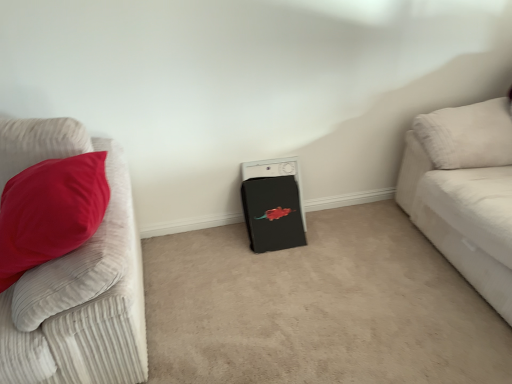
Question: Is velvet red pillow at left, placed as the 2th studio couch when sorted from right to left, inside or outside of black matte washing machine at center?

Choices:
 (A) outside
 (B) inside

Answer: (A)

Question: Considering the positions of velvet red pillow at left, placed as the 1th studio couch when sorted from left to right, and black matte washing machine at center in the image, is velvet red pillow at left, placed as the 1th studio couch when sorted from left to right, taller or shorter than black matte washing machine at center?

Choices:
 (A) short
 (B) tall

Answer: (B)

Question: Which object is positioned closest to the velvet red pillow at left, placed as the 1th studio couch when sorted from left to right?

Choices:
 (A) white corduroy couch at right, the 2th studio couch when ordered from left to right
 (B) black matte washing machine at center

Answer: (B)

Question: Which is nearer to the velvet red pillow at left, placed as the 2th studio couch when sorted from right to left?

Choices:
 (A) black matte washing machine at center
 (B) white corduroy couch at right, the first studio couch viewed from the right

Answer: (A)